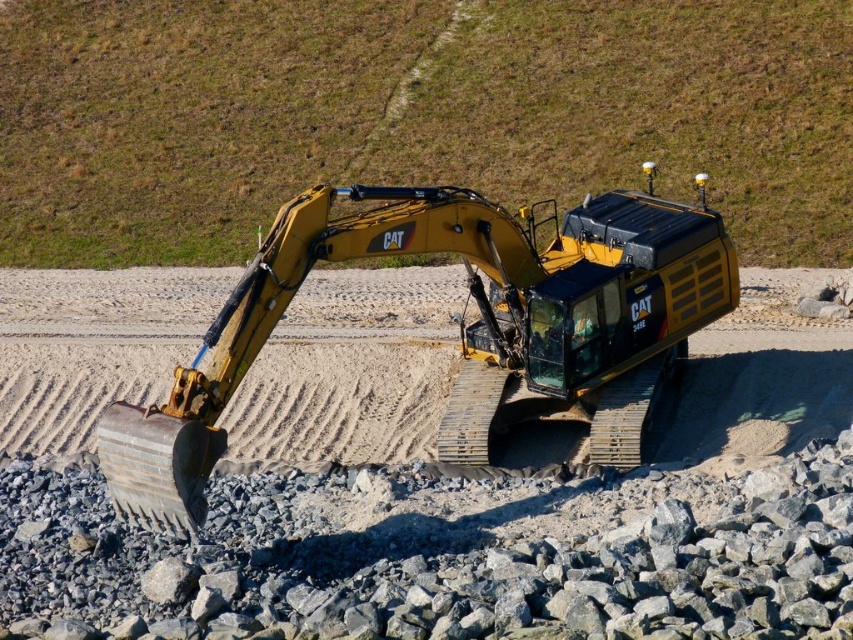
Question: Which is nearer to the yellow metallic tractor at center?

Choices:
 (A) yellow rubber tracks at center
 (B) gray gravel at lower center

Answer: (B)

Question: Can you confirm if yellow rubber tracks at center is bigger than yellow metallic tractor at center?

Choices:
 (A) no
 (B) yes

Answer: (B)

Question: Among these objects, which one is nearest to the camera?

Choices:
 (A) yellow metallic tractor at center
 (B) yellow rubber tracks at center

Answer: (A)

Question: Can you confirm if yellow rubber tracks at center is positioned below yellow metallic tractor at center?

Choices:
 (A) yes
 (B) no

Answer: (B)

Question: Can you confirm if gray gravel at lower center is smaller than yellow metallic tractor at center?

Choices:
 (A) yes
 (B) no

Answer: (A)

Question: Which point is closer to the camera taking this photo?

Choices:
 (A) (189, 577)
 (B) (485, 202)
 (C) (529, 8)

Answer: (A)